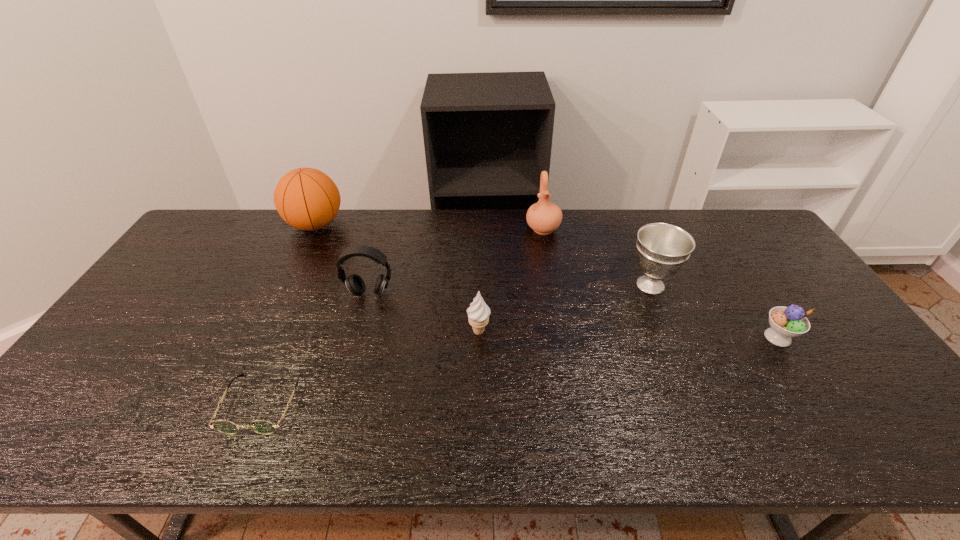
The height and width of the screenshot is (540, 960). I want to click on free region at the far edge of the desktop, so click(x=616, y=209).

Where is `vacant position at the near edge of the desktop`? This screenshot has height=540, width=960. vacant position at the near edge of the desktop is located at coordinates (420, 426).

I want to click on blank space at the left edge, so click(x=189, y=270).

Identify the location of vacant area at the right edge. The height and width of the screenshot is (540, 960). (831, 389).

The width and height of the screenshot is (960, 540). I want to click on vacant space at the far left corner, so click(x=198, y=239).

At what (x,y) coordinates should I click in order to perform the action: click on free location at the near right corner of the desktop. Please return your answer as a coordinate pair (x, y). Image resolution: width=960 pixels, height=540 pixels. Looking at the image, I should click on (897, 417).

I want to click on empty location between the third object from left to right and the fourth object from left to right, so click(424, 312).

Locate an element on the screen. The image size is (960, 540). blank region between the basketball and the fifth object from left to right is located at coordinates (429, 227).

The image size is (960, 540). Find the location of `free space between the basketball and the shorter icecream`. free space between the basketball and the shorter icecream is located at coordinates (546, 281).

Where is `free space between the pottery and the basketball`? This screenshot has height=540, width=960. free space between the pottery and the basketball is located at coordinates (429, 227).